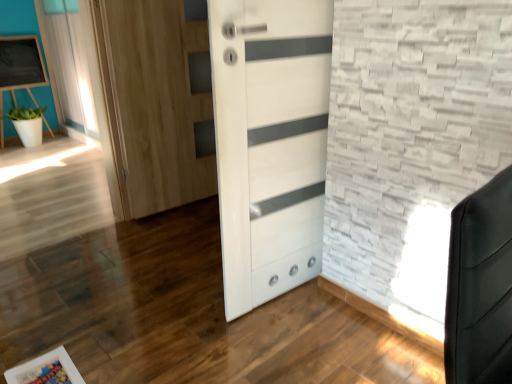
Question: Is white sheer curtain at upper left to the right of wooden picture frame at lower left from the viewer's perspective?

Choices:
 (A) no
 (B) yes

Answer: (A)

Question: Is white sheer curtain at upper left smaller than wooden picture frame at lower left?

Choices:
 (A) yes
 (B) no

Answer: (B)

Question: From a real-world perspective, is white sheer curtain at upper left below wooden picture frame at lower left?

Choices:
 (A) no
 (B) yes

Answer: (A)

Question: Does white sheer curtain at upper left have a lesser height compared to wooden picture frame at lower left?

Choices:
 (A) yes
 (B) no

Answer: (B)

Question: Is white sheer curtain at upper left with wooden picture frame at lower left?

Choices:
 (A) no
 (B) yes

Answer: (A)

Question: Relative to white matte pot at left, is white sheer curtain at upper left in front or behind?

Choices:
 (A) behind
 (B) front

Answer: (B)

Question: Is white sheer curtain at upper left taller or shorter than white matte pot at left?

Choices:
 (A) short
 (B) tall

Answer: (B)

Question: From a real-world perspective, relative to white matte pot at left, is white sheer curtain at upper left vertically above or below?

Choices:
 (A) above
 (B) below

Answer: (A)

Question: From the image's perspective, relative to white matte pot at left, is white sheer curtain at upper left above or below?

Choices:
 (A) below
 (B) above

Answer: (B)

Question: Would you say matte black chalkboard at upper left is inside or outside white glossy door at center?

Choices:
 (A) outside
 (B) inside

Answer: (A)

Question: In terms of height, does matte black chalkboard at upper left look taller or shorter compared to white glossy door at center?

Choices:
 (A) short
 (B) tall

Answer: (A)

Question: From the image's perspective, relative to white glossy door at center, is matte black chalkboard at upper left above or below?

Choices:
 (A) above
 (B) below

Answer: (A)

Question: Would you say matte black chalkboard at upper left is to the left or to the right of white glossy door at center in the picture?

Choices:
 (A) left
 (B) right

Answer: (A)

Question: Which is correct: white sheer curtain at upper left is inside wooden picture frame at lower left, or outside of it?

Choices:
 (A) outside
 (B) inside

Answer: (A)

Question: Is white sheer curtain at upper left wider or thinner than wooden picture frame at lower left?

Choices:
 (A) thin
 (B) wide

Answer: (A)